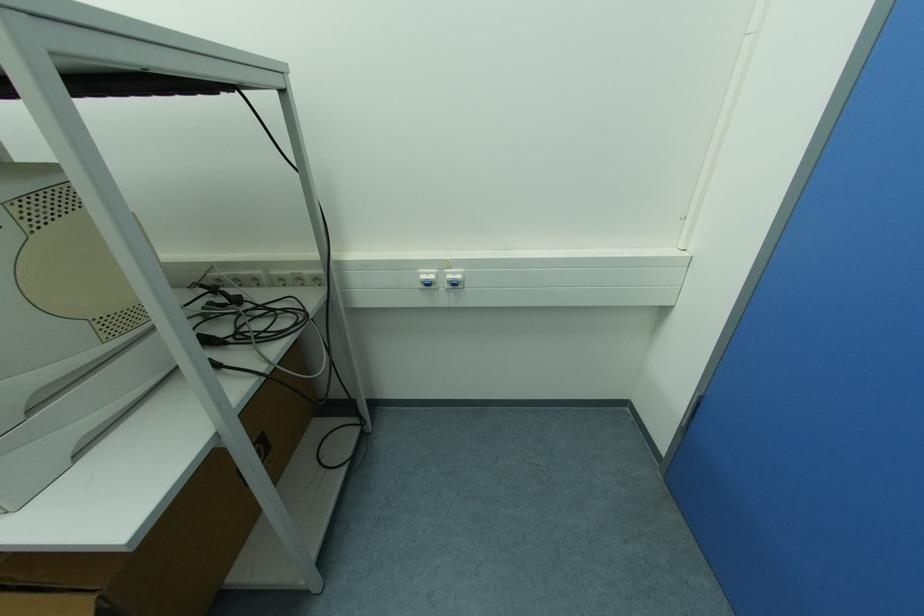
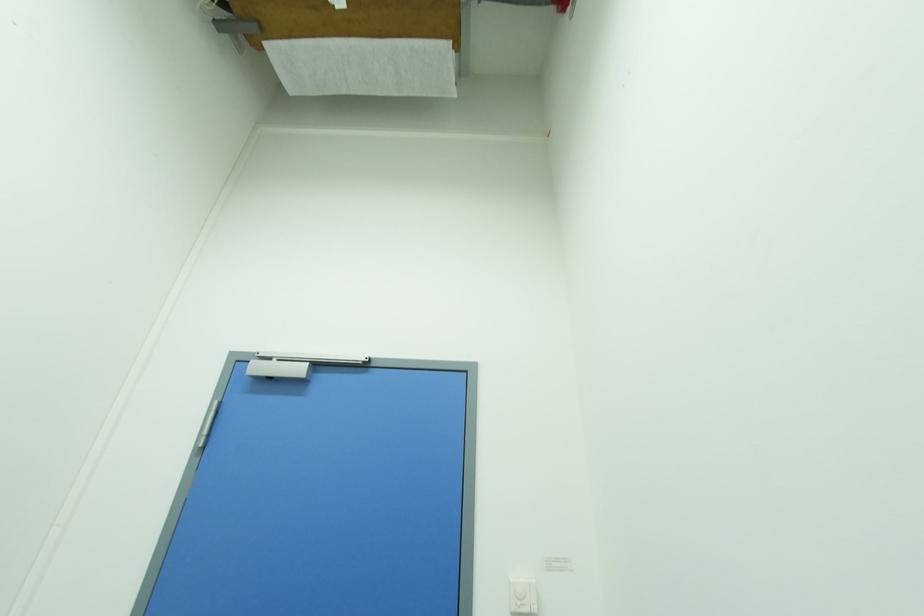
First-person continuous shooting, in which direction is the camera rotating?

The rotation direction of the camera is right-up.